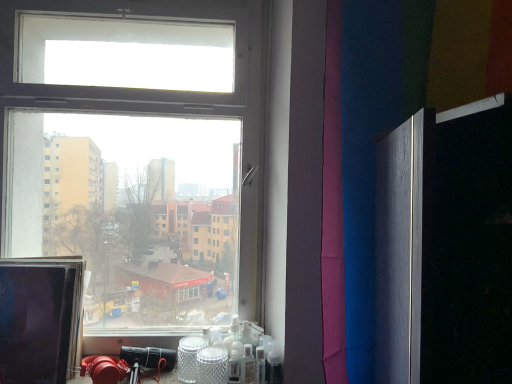
Question: In which direction should I rotate to look at clear plastic spray bottle at lower center, the 1th toiletry when ordered from left to right?

Choices:
 (A) right
 (B) left

Answer: (B)

Question: Is matte black monitor at left thinner than translucent plastic spray bottle at lower right, which ranks as the 2th toiletry in left-to-right order?

Choices:
 (A) no
 (B) yes

Answer: (A)

Question: Is matte black monitor at left wider than translucent plastic spray bottle at lower right, which appears as the first toiletry when viewed from the right?

Choices:
 (A) yes
 (B) no

Answer: (A)

Question: Is matte black monitor at left aimed at translucent plastic spray bottle at lower right, which ranks as the 2th toiletry in left-to-right order?

Choices:
 (A) no
 (B) yes

Answer: (A)

Question: Is matte black monitor at left to the right of translucent plastic spray bottle at lower right, which appears as the first toiletry when viewed from the right, from the viewer's perspective?

Choices:
 (A) no
 (B) yes

Answer: (A)

Question: Is matte black monitor at left smaller than translucent plastic spray bottle at lower right, which ranks as the 2th toiletry in left-to-right order?

Choices:
 (A) no
 (B) yes

Answer: (A)

Question: Is matte black monitor at left beside translucent plastic spray bottle at lower right, which appears as the first toiletry when viewed from the right?

Choices:
 (A) yes
 (B) no

Answer: (B)

Question: From the image's perspective, is clear plastic spray bottle at lower center, the 1th toiletry when ordered from left to right, located above translucent plastic spray bottle at lower right, which appears as the first toiletry when viewed from the right?

Choices:
 (A) no
 (B) yes

Answer: (A)

Question: Is translucent plastic spray bottle at lower right, which appears as the first toiletry when viewed from the right, inside clear plastic spray bottle at lower center, the 1th toiletry when ordered from left to right?

Choices:
 (A) yes
 (B) no

Answer: (B)

Question: Is clear plastic spray bottle at lower center, the 1th toiletry when ordered from left to right, touching translucent plastic spray bottle at lower right, which appears as the first toiletry when viewed from the right?

Choices:
 (A) no
 (B) yes

Answer: (B)

Question: Could you tell me if clear plastic spray bottle at lower center, acting as the 2th toiletry starting from the right, is turned towards translucent plastic spray bottle at lower right, which ranks as the 2th toiletry in left-to-right order?

Choices:
 (A) yes
 (B) no

Answer: (B)

Question: From a real-world perspective, is clear plastic spray bottle at lower center, the 1th toiletry when ordered from left to right, on translucent plastic spray bottle at lower right, which appears as the first toiletry when viewed from the right?

Choices:
 (A) yes
 (B) no

Answer: (B)

Question: Does clear plastic spray bottle at lower center, acting as the 2th toiletry starting from the right, have a lesser width compared to translucent plastic spray bottle at lower right, which appears as the first toiletry when viewed from the right?

Choices:
 (A) yes
 (B) no

Answer: (A)

Question: Considering the relative sizes of clear plastic spray bottle at lower center, the 1th toiletry when ordered from left to right, and matte black monitor at left in the image provided, is clear plastic spray bottle at lower center, the 1th toiletry when ordered from left to right, thinner than matte black monitor at left?

Choices:
 (A) yes
 (B) no

Answer: (A)